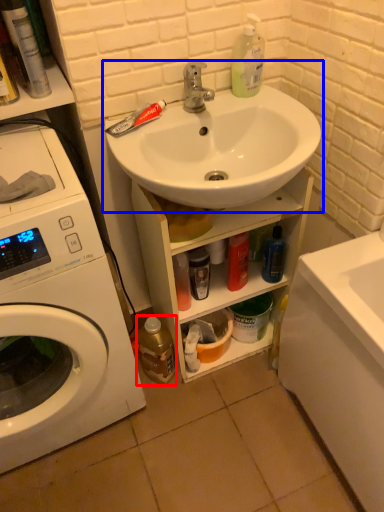
Question: Which object appears closest to the camera in this image, bottle (highlighted by a red box) or sink (highlighted by a blue box)?

Choices:
 (A) bottle
 (B) sink

Answer: (B)